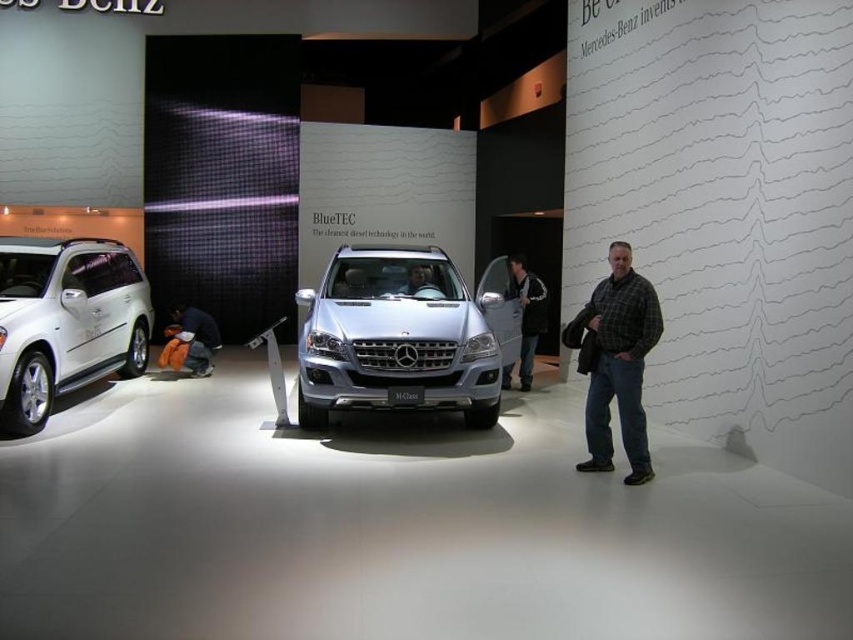
Question: Based on their relative distances, which object is farther from the white matte suv at left?

Choices:
 (A) dark gray jacket at center
 (B) satin silver suv at center

Answer: (A)

Question: Does satin silver suv at center have a greater width compared to white matte suv at left?

Choices:
 (A) yes
 (B) no

Answer: (A)

Question: Does satin silver suv at center have a larger size compared to plaid shirt at right?

Choices:
 (A) yes
 (B) no

Answer: (A)

Question: Can you confirm if white matte suv at left is thinner than plaid shirt at right?

Choices:
 (A) yes
 (B) no

Answer: (B)

Question: Which of these objects is positioned farthest from the white matte suv at left?

Choices:
 (A) dark gray jacket at center
 (B) satin silver suv at center
 (C) plaid shirt at right

Answer: (C)

Question: Which object is the closest to the plaid shirt at right?

Choices:
 (A) white matte suv at left
 (B) dark gray jacket at center
 (C) satin silver suv at center

Answer: (C)